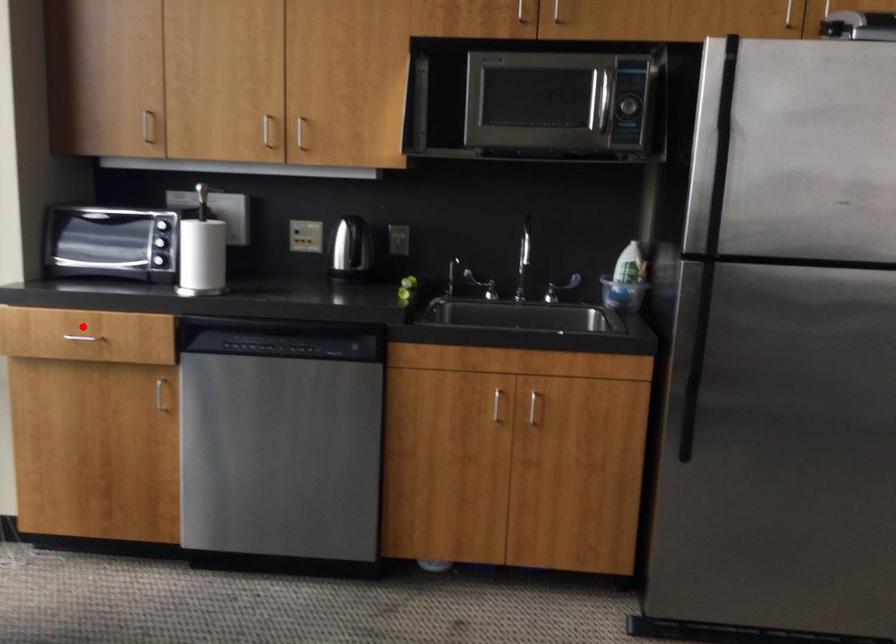
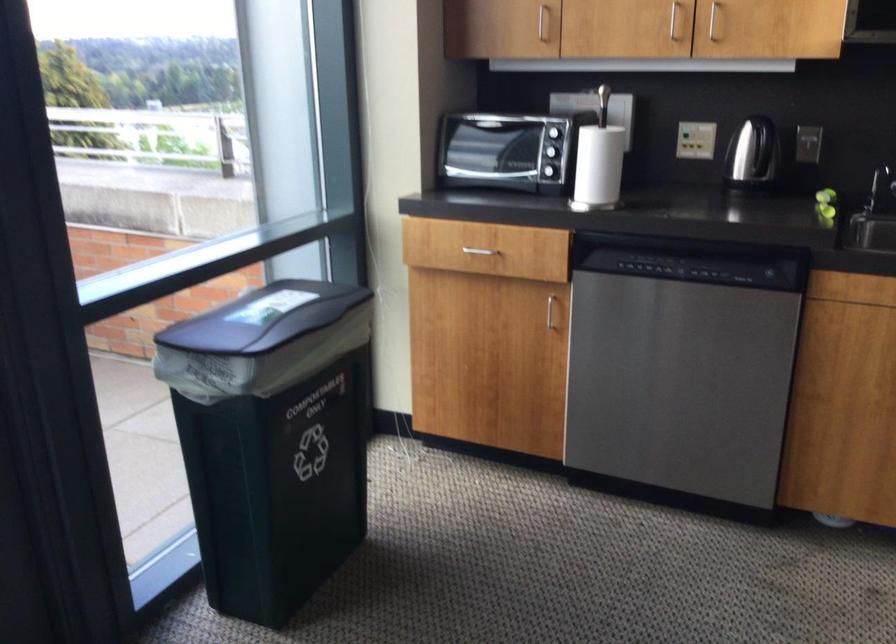
Locate, in the second image, the point that corresponds to the highlighted location in the first image.

(474, 241)